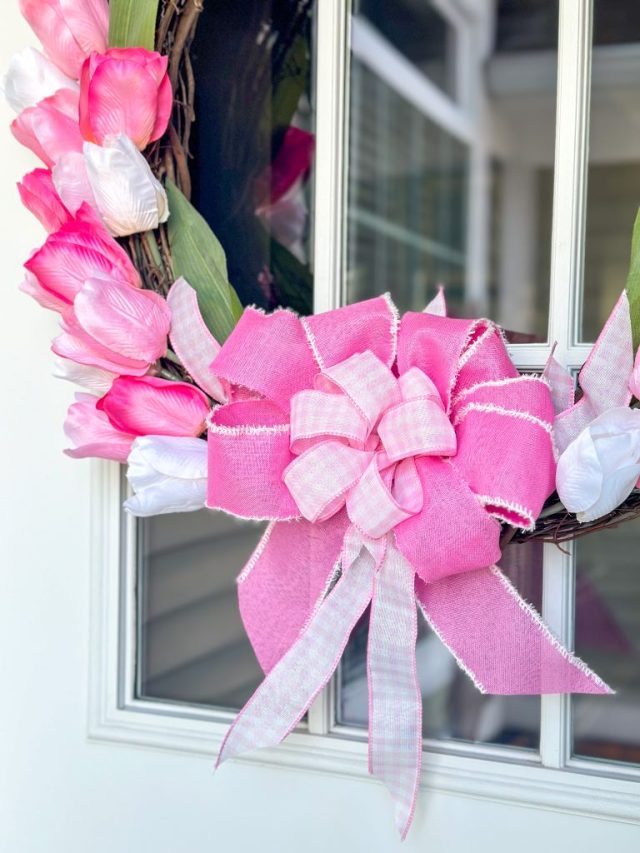
At what (x,y) coordinates should I click in order to perform the action: click on window. Please return your answer as a coordinate pair (x, y). The width and height of the screenshot is (640, 853). Looking at the image, I should click on (275, 153), (512, 200), (614, 189), (164, 642), (524, 721), (617, 720).